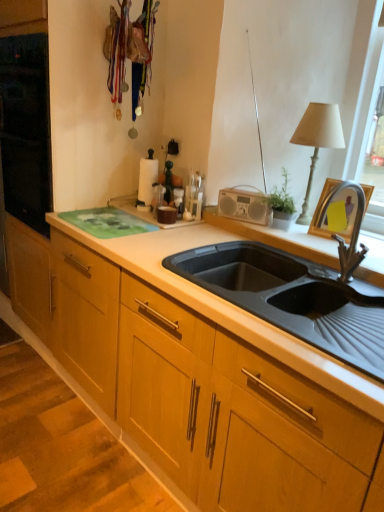
Question: Considering the relative sizes of white paper towel holder at upper center and black rubber sink at center in the image provided, is white paper towel holder at upper center thinner than black rubber sink at center?

Choices:
 (A) yes
 (B) no

Answer: (A)

Question: Considering the relative positions of white paper towel holder at upper center and black rubber sink at center in the image provided, is white paper towel holder at upper center to the right of black rubber sink at center from the viewer's perspective?

Choices:
 (A) no
 (B) yes

Answer: (A)

Question: Is white paper towel holder at upper center further to the viewer compared to black rubber sink at center?

Choices:
 (A) no
 (B) yes

Answer: (B)

Question: Is white paper towel holder at upper center located outside black rubber sink at center?

Choices:
 (A) yes
 (B) no

Answer: (A)

Question: Does white paper towel holder at upper center have a smaller size compared to black rubber sink at center?

Choices:
 (A) no
 (B) yes

Answer: (B)

Question: In the image, is white paper towel holder at upper center on the left side or the right side of black rubber sink at center?

Choices:
 (A) left
 (B) right

Answer: (A)

Question: Considering the positions of white paper towel holder at upper center and black rubber sink at center in the image, is white paper towel holder at upper center wider or thinner than black rubber sink at center?

Choices:
 (A) thin
 (B) wide

Answer: (A)

Question: From a real-world perspective, is white paper towel holder at upper center physically located above or below black rubber sink at center?

Choices:
 (A) below
 (B) above

Answer: (B)

Question: From the image's perspective, is white paper towel holder at upper center located above or below black rubber sink at center?

Choices:
 (A) below
 (B) above

Answer: (B)

Question: Would you say white fabric lampshade at upper right is inside or outside white paper towel holder at upper center?

Choices:
 (A) inside
 (B) outside

Answer: (B)

Question: From a real-world perspective, is white fabric lampshade at upper right positioned above or below white paper towel holder at upper center?

Choices:
 (A) above
 (B) below

Answer: (A)

Question: Looking at their shapes, would you say white fabric lampshade at upper right is wider or thinner than white paper towel holder at upper center?

Choices:
 (A) thin
 (B) wide

Answer: (B)

Question: In terms of size, does white fabric lampshade at upper right appear bigger or smaller than white paper towel holder at upper center?

Choices:
 (A) big
 (B) small

Answer: (A)

Question: Is white paper towel holder at upper center in front of or behind white fabric lampshade at upper right in the image?

Choices:
 (A) front
 (B) behind

Answer: (B)

Question: Visually, is white paper towel holder at upper center positioned to the left or to the right of white fabric lampshade at upper right?

Choices:
 (A) right
 (B) left

Answer: (B)